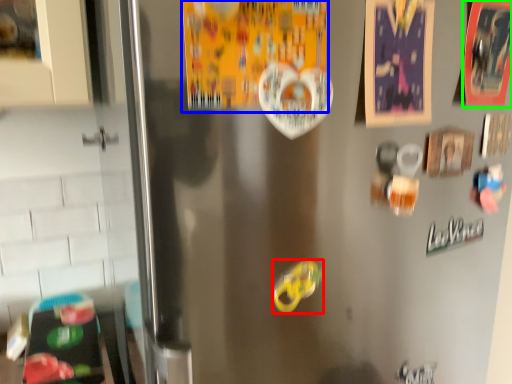
Question: Which is farther away from food (highlighted by a red box)? postcard (highlighted by a blue box) or postcard (highlighted by a green box)?

Choices:
 (A) postcard
 (B) postcard

Answer: (B)